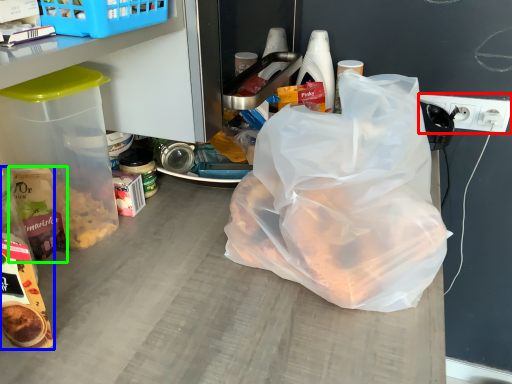
Question: Which is nearer to the electric outlet (highlighted by a red box)? snack (highlighted by a blue box) or cereal (highlighted by a green box).

Choices:
 (A) snack
 (B) cereal

Answer: (B)